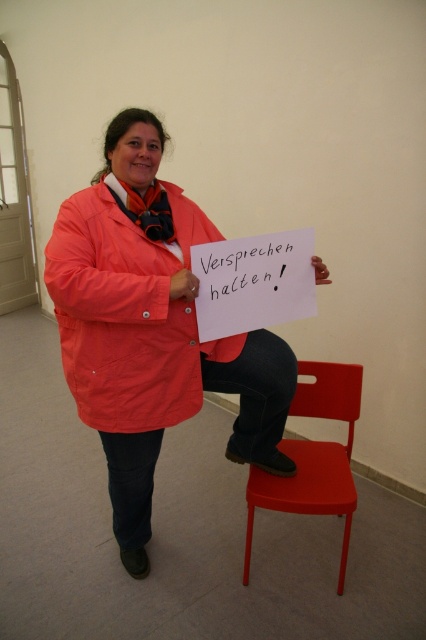
You are a delivery person who needs to place a package between the matte nylon jacket at center and the matte plastic chair at lower center. The package is 15 inches long. Will there be enough space between them to fit the package?

The distance between the matte nylon jacket at center and the matte plastic chair at lower center is 14.82 inches. Since the package is 15 inches long, it will not fit between them as the space is slightly smaller than the package.

In the scene, you see a matte nylon jacket at center and a matte plastic chair at lower center. Which object is positioned to the left of the other?

The matte nylon jacket at center is to the left of the matte plastic chair at lower center.